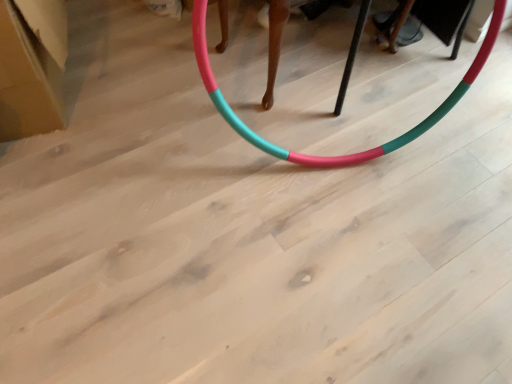
Image resolution: width=512 pixels, height=384 pixels. I want to click on vacant point to the right of white cardboard box at upper left, so click(x=134, y=92).